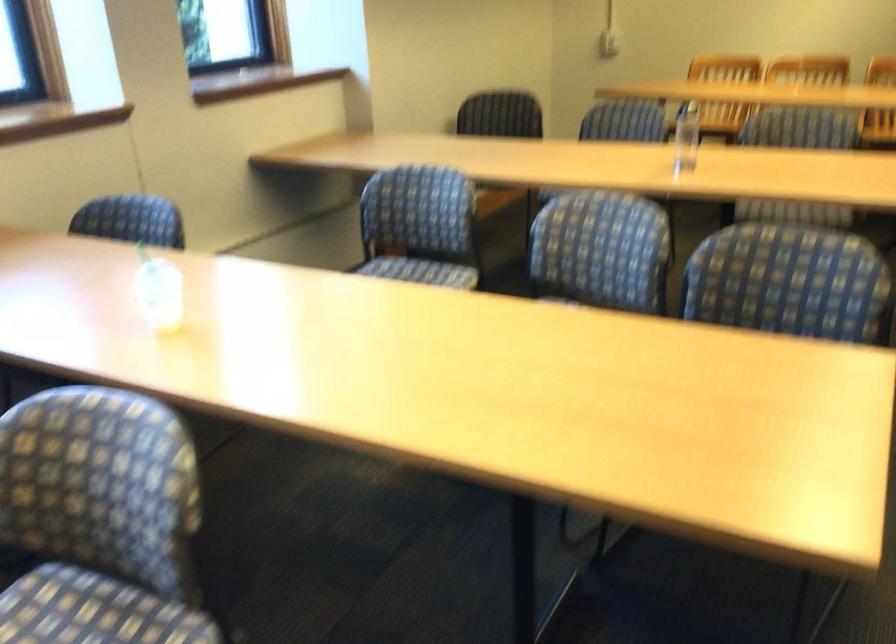
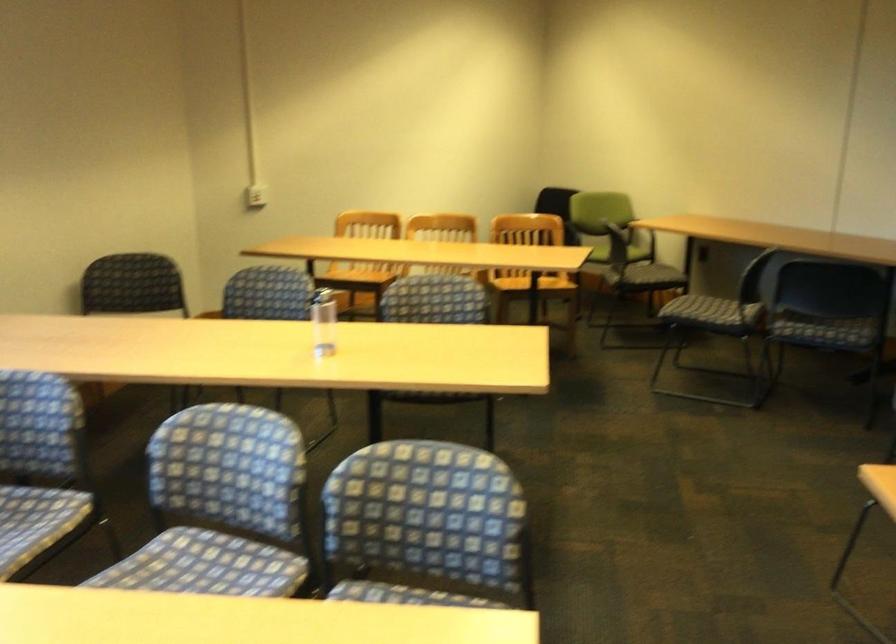
Locate, in the second image, the point that corresponds to (590,279) in the first image.

(221, 506)